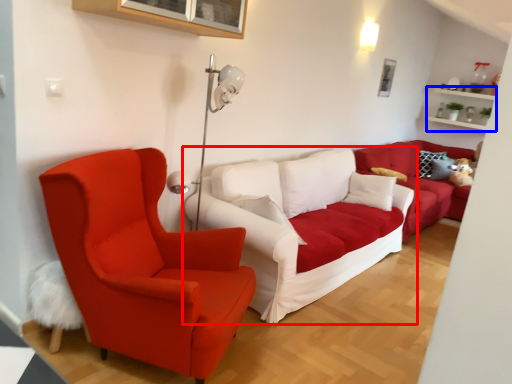
Question: Which object is closer to the camera taking this photo, studio couch (highlighted by a red box) or shelf (highlighted by a blue box)?

Choices:
 (A) studio couch
 (B) shelf

Answer: (A)